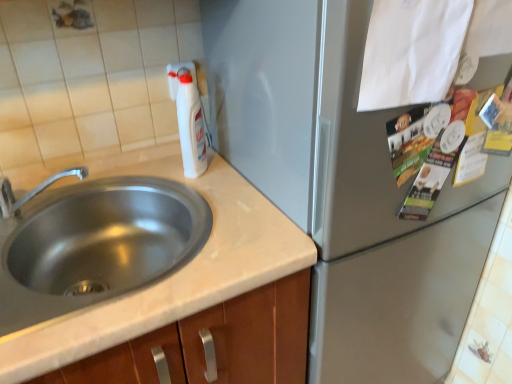
The height and width of the screenshot is (384, 512). What are the coordinates of `free space to the back side of brushed metal faucet at left` in the screenshot? It's located at (81, 193).